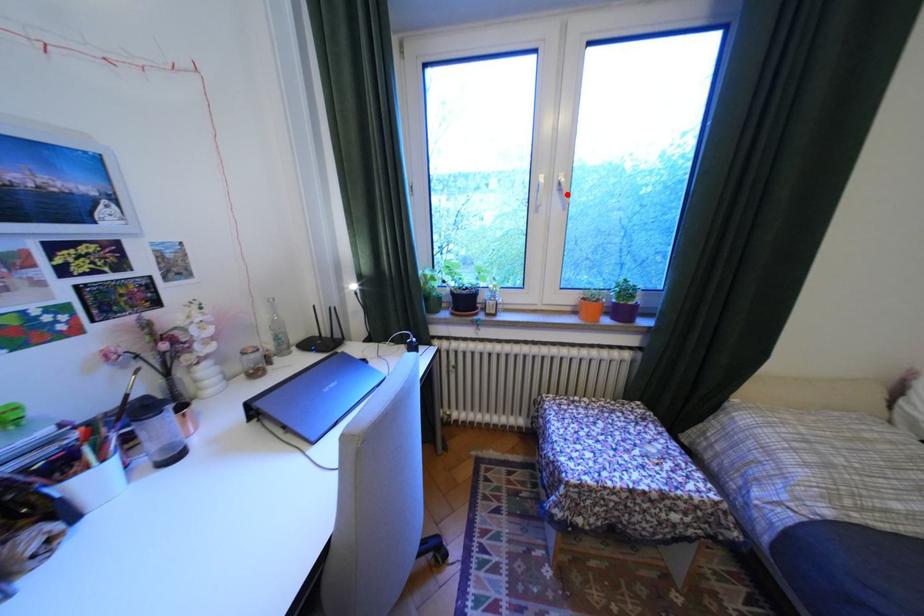
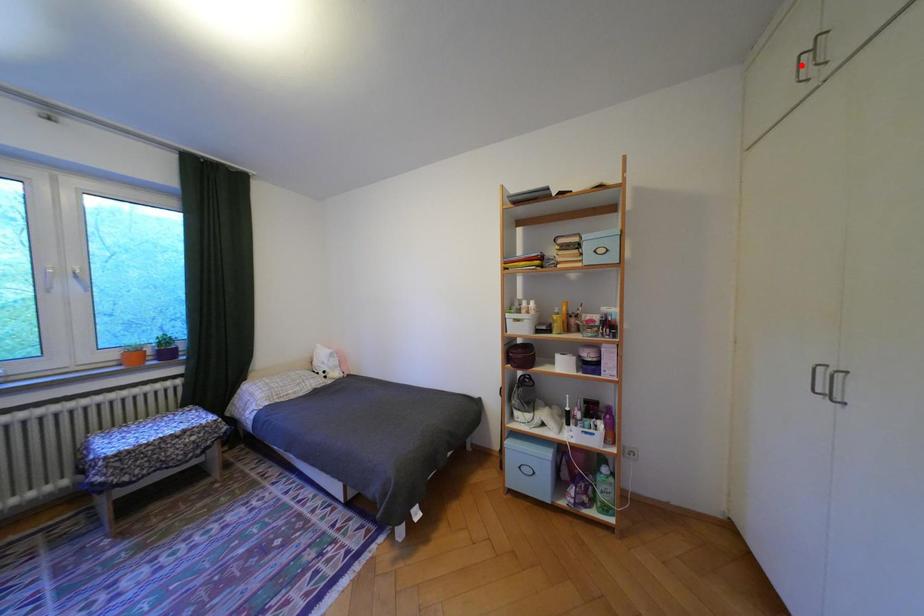
I am providing you with two images of the same scene from different viewpoints. A red point is marked on the first image and another point is marked on the second image. Do the highlighted points in image1 and image2 indicate the same real-world spot?

No